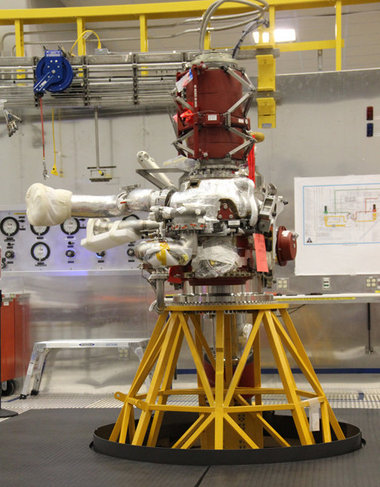
Where is `white metal stand, center left`? The image size is (380, 487). white metal stand, center left is located at coordinates (73, 347), (120, 344), (30, 365), (142, 360).